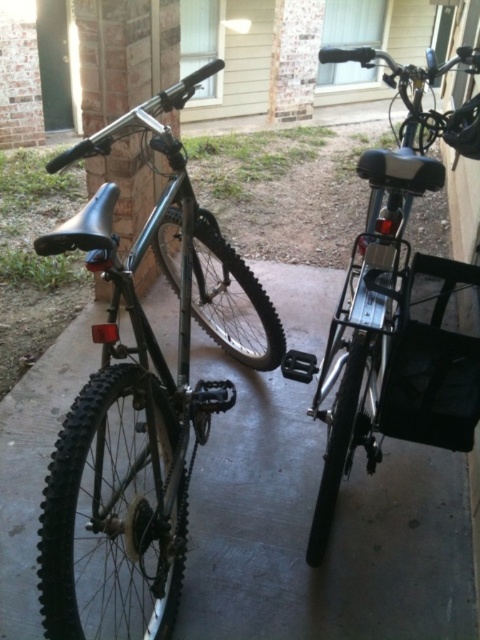
You are a delivery person who needs to load a 18 inches wide box between the matte black bicycle at left and the metallic silver bicycle at right. Can the box fit in the space between them?

The matte black bicycle at left is 17.66 inches from the metallic silver bicycle at right, so the 18 inches wide box cannot fit between them because the distance is slightly less than the box width.

You are standing on the concrete surface where the two bicycles are parked. You want to move your backpack from the matte black bicycle at left to the metallic silver bicycle at right. Which direction should you move the backpack?

The matte black bicycle at left is to the left of the metallic silver bicycle at right, so you should move the backpack to the right.